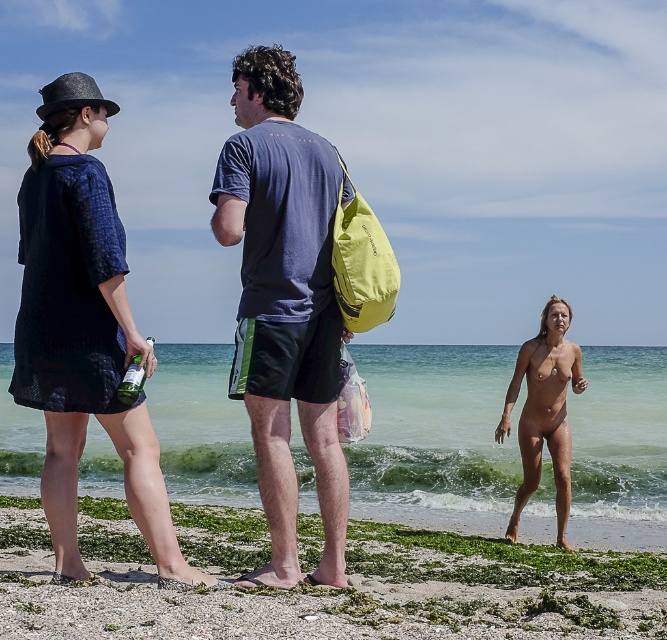
Question: Can you confirm if smooth sand at lower center is smaller than blue textured dress at left?

Choices:
 (A) yes
 (B) no

Answer: (A)

Question: Can you confirm if clear water at lower right is wider than blue textured dress at left?

Choices:
 (A) no
 (B) yes

Answer: (B)

Question: Which of these objects is positioned closest to the smooth skin body at lower right?

Choices:
 (A) clear water at lower right
 (B) blue textured dress at left
 (C) smooth sand at lower center
 (D) matte blue t-shirt at center

Answer: (C)

Question: Where is smooth sand at lower center located in relation to blue textured dress at left in the image?

Choices:
 (A) below
 (B) above

Answer: (A)

Question: Among these points, which one is farthest from the camera?

Choices:
 (A) (119, 340)
 (B) (253, 275)
 (C) (147, 340)
 (D) (0, 456)

Answer: (D)

Question: Among these points, which one is farthest from the camera?

Choices:
 (A) (x=173, y=460)
 (B) (x=534, y=442)
 (C) (x=139, y=371)
 (D) (x=121, y=605)

Answer: (A)